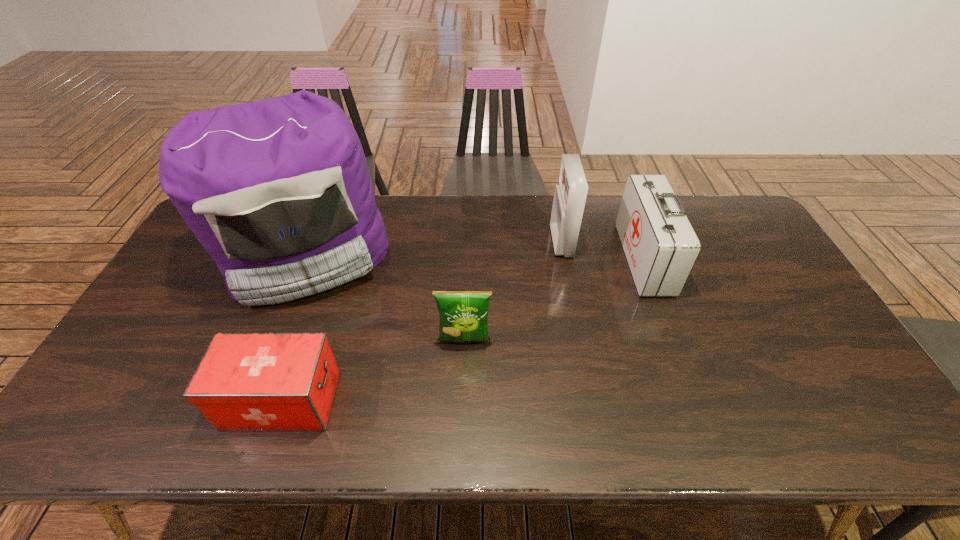
At what (x,y) coordinates should I click in order to perform the action: click on backpack. Please return your answer as a coordinate pair (x, y). Looking at the image, I should click on (278, 192).

In order to click on the fourth object from left to right in this screenshot , I will do `click(570, 194)`.

This screenshot has width=960, height=540. I want to click on the tallest first-aid kit, so click(x=570, y=194).

Locate an element on the screen. the second tallest first-aid kit is located at coordinates (661, 247).

I want to click on the rightmost first-aid kit, so click(661, 247).

I want to click on the second nearest object, so click(463, 315).

Identify the location of the third object from right to left. This screenshot has width=960, height=540. (463, 315).

Where is `the leftmost first-aid kit`? the leftmost first-aid kit is located at coordinates (246, 381).

Where is `the nearest first-aid kit`? This screenshot has height=540, width=960. the nearest first-aid kit is located at coordinates (246, 381).

This screenshot has width=960, height=540. Identify the location of blank area located on the front pocket of the backpack. (254, 393).